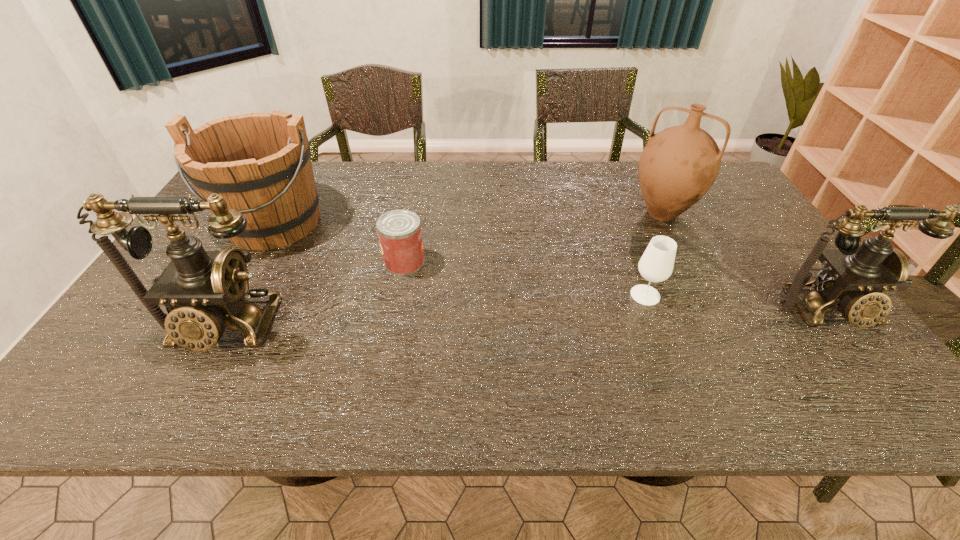
The height and width of the screenshot is (540, 960). Identify the location of object at the near right corner. (853, 277).

I want to click on free space at the far edge of the desktop, so click(x=487, y=161).

This screenshot has width=960, height=540. Find the location of `vacant space at the near edge of the desktop`. vacant space at the near edge of the desktop is located at coordinates (638, 335).

Identify the location of free location at the right edge. The width and height of the screenshot is (960, 540). (724, 227).

This screenshot has height=540, width=960. Find the location of `free point between the fourth object from right to left and the pitcher`. free point between the fourth object from right to left and the pitcher is located at coordinates (533, 238).

Find the location of a particular element. The width and height of the screenshot is (960, 540). free space between the fourth object from right to left and the wine bucket is located at coordinates (340, 242).

The image size is (960, 540). Identify the location of free spot between the pitcher and the wine bucket. (468, 218).

Locate an element on the screen. Image resolution: width=960 pixels, height=540 pixels. free point between the fifth object from left to right and the rightmost object is located at coordinates (745, 262).

The image size is (960, 540). I want to click on vacant space that is in between the glass and the rightmost object, so click(x=737, y=303).

The width and height of the screenshot is (960, 540). Identify the location of free spot between the taller telephone and the shortest object. (313, 295).